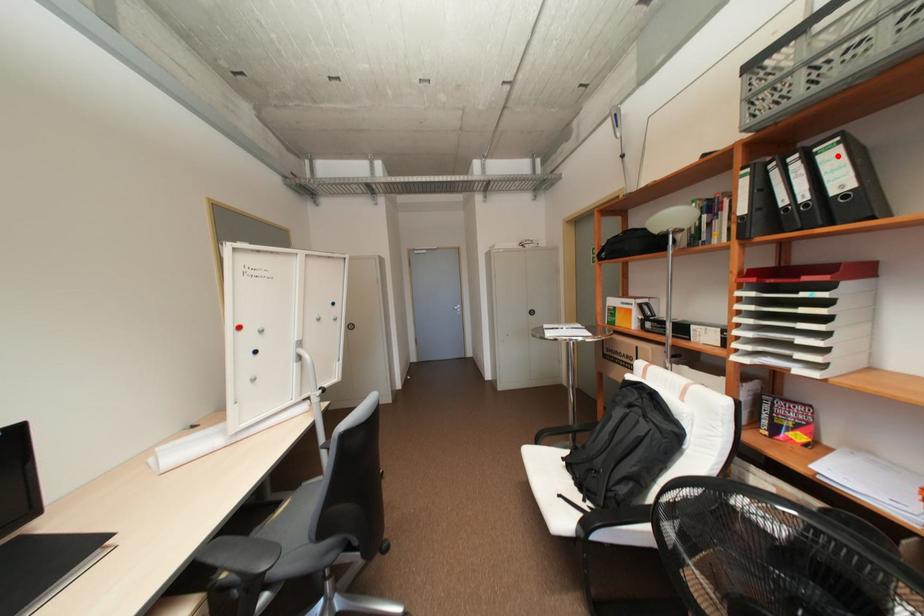
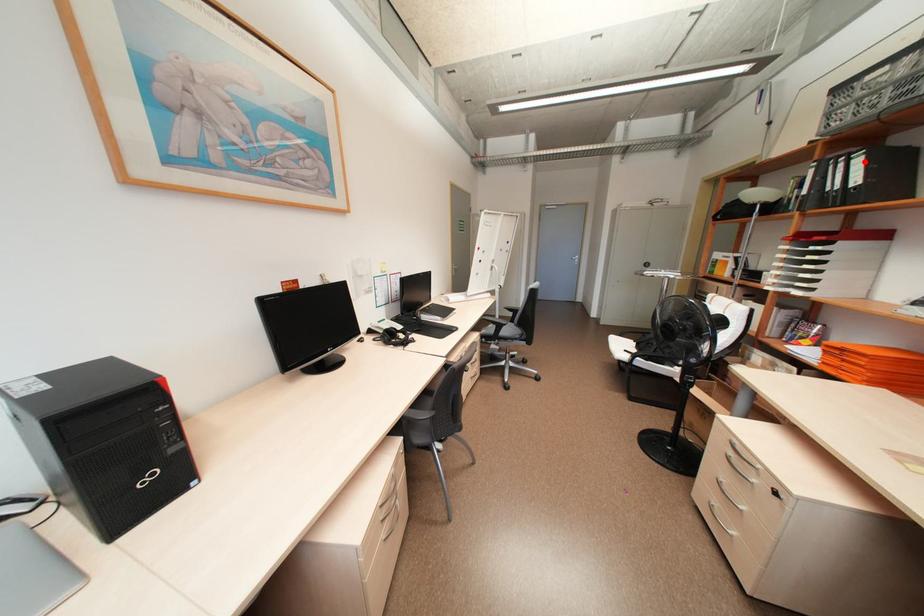
I am providing you with two images of the same scene from different viewpoints. A red point is marked on the first image and another point is marked on the second image. Do the highlighted points in image1 and image2 indicate the same real-world spot?

Yes